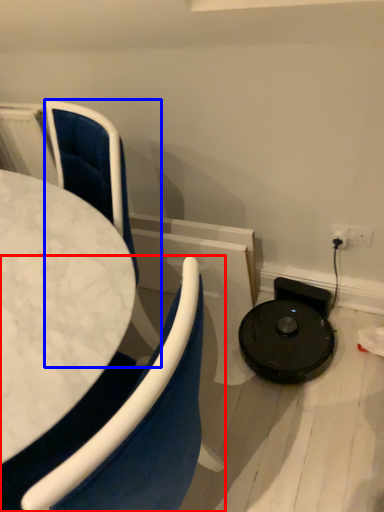
Question: Which point is closer to the camera, chair (highlighted by a red box) or chair (highlighted by a blue box)?

Choices:
 (A) chair
 (B) chair

Answer: (A)